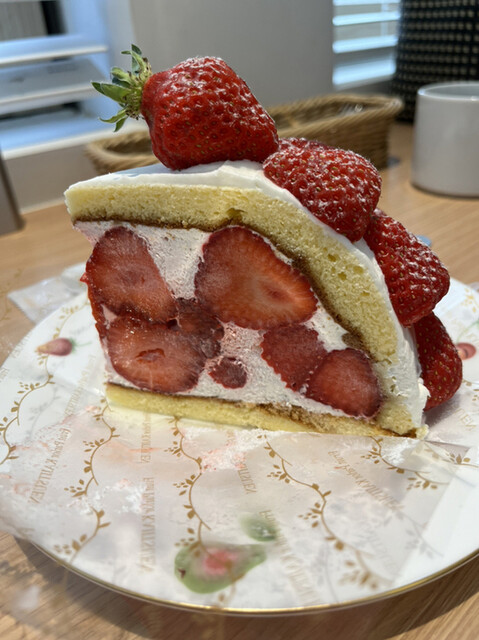
Locate an element on the screen. This screenshot has height=640, width=479. wooden table is located at coordinates (45, 240).